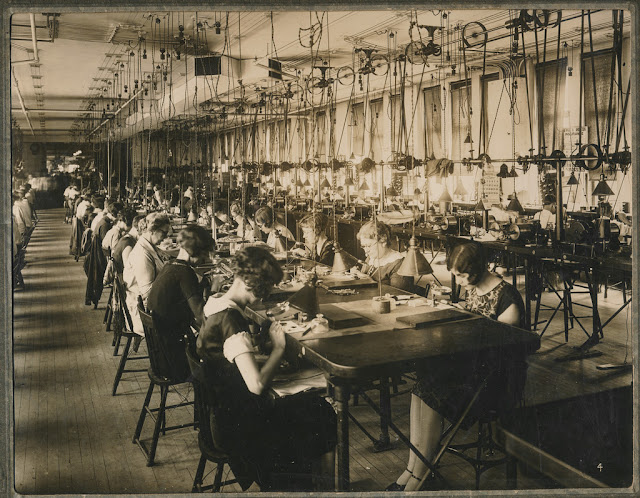
Locate an element on the screen. This screenshot has width=640, height=498. bench is located at coordinates (418, 371), (619, 269), (593, 434).